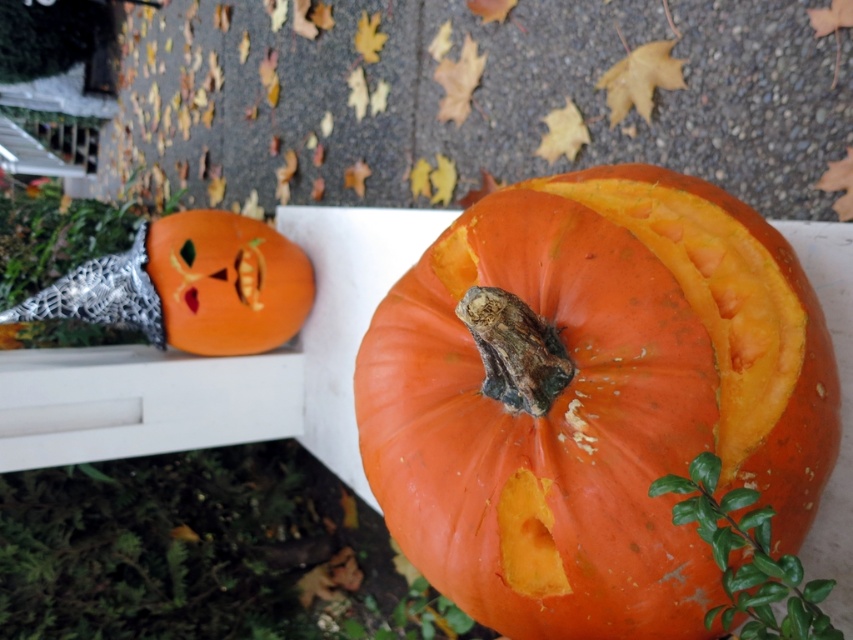
Does orange matte pumpkin at center appear under orange matte pumpkin at upper left?

Indeed, orange matte pumpkin at center is positioned under orange matte pumpkin at upper left.

Is orange matte pumpkin at center shorter than orange matte pumpkin at upper left?

In fact, orange matte pumpkin at center may be taller than orange matte pumpkin at upper left.

Locate an element on the screen. orange matte pumpkin at center is located at coordinates (592, 397).